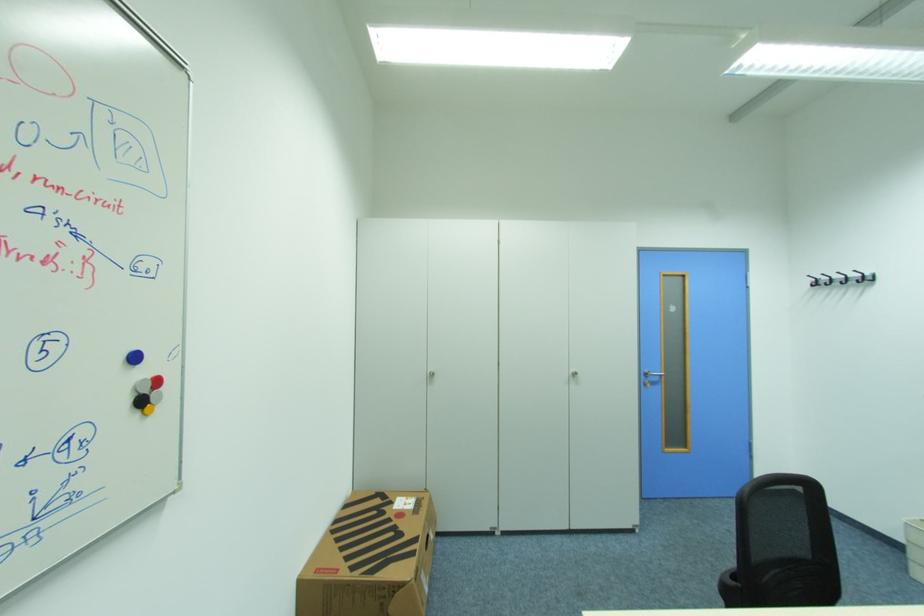
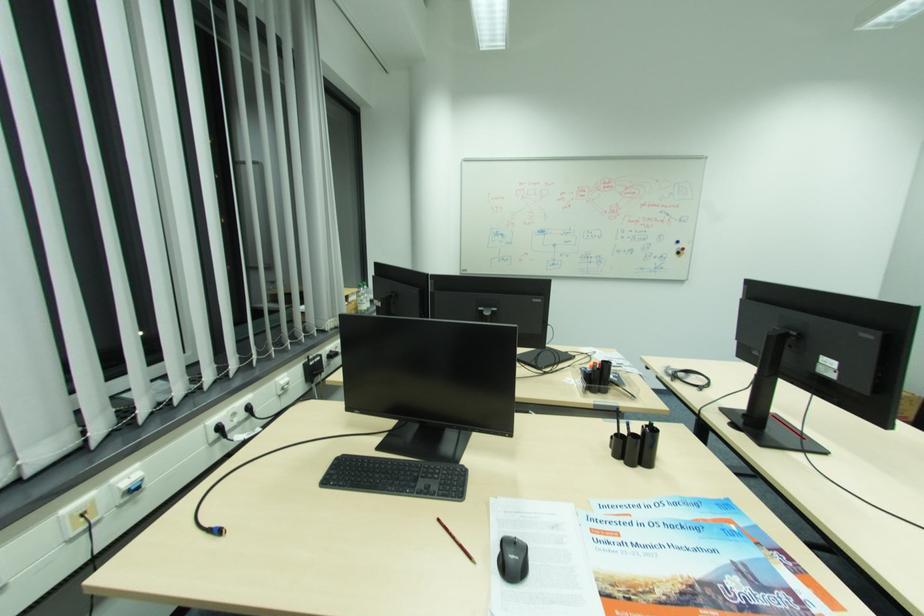
Where in the second image is the point corresponding to (146,403) from the first image?

(684, 253)